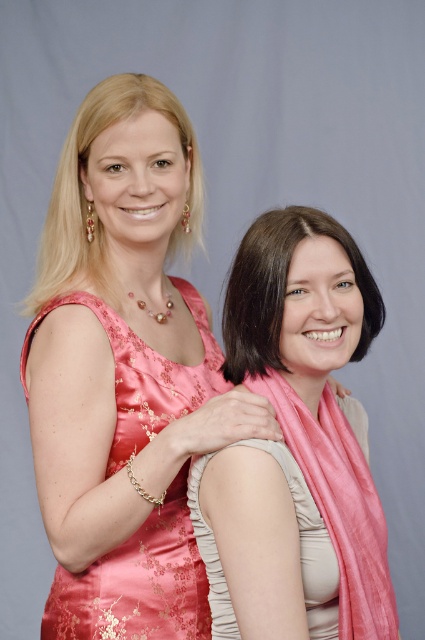
Image resolution: width=425 pixels, height=640 pixels. In order to click on satin dress at left in this screenshot , I will do `click(138, 582)`.

Can you confirm if satin dress at left is thinner than smooth brown hair at center?

In fact, satin dress at left might be wider than smooth brown hair at center.

Is point (221, 385) in front of point (277, 240)?

No, (221, 385) is further to viewer.

You are a GUI agent. You are given a task and a screenshot of the screen. Output one action in this format:
    pyautogui.click(x=<x>, y=<y>)
    Task: Click on the satin dress at left
    
    Given the screenshot: What is the action you would take?
    pyautogui.click(x=138, y=582)

Is point (280, 259) positioned after point (166, 516)?

No.

Can you confirm if pink silk scarf at right is bigger than satin dress at left?

Yes, pink silk scarf at right is bigger than satin dress at left.

Who is more distant from viewer, (x=283, y=211) or (x=79, y=636)?

Point (x=79, y=636)

You are a GUI agent. You are given a task and a screenshot of the screen. Output one action in this format:
    pyautogui.click(x=<x>, y=<y>)
    Task: Click on the pink silk scarf at right
    The width and height of the screenshot is (425, 640).
    Given the screenshot: What is the action you would take?
    pyautogui.click(x=295, y=445)

Is point (384, 621) less distant than point (255, 276)?

No, it is behind (255, 276).

You are a GUI agent. You are given a task and a screenshot of the screen. Output one action in this format:
    pyautogui.click(x=<x>, y=<y>)
    Task: Click on the pink silk scarf at right
    The height and width of the screenshot is (640, 425).
    Given the screenshot: What is the action you would take?
    pyautogui.click(x=295, y=445)

Is point (309, 461) in front of point (269, 330)?

That is True.

Find the location of a particular element. pink silk scarf at right is located at coordinates (295, 445).